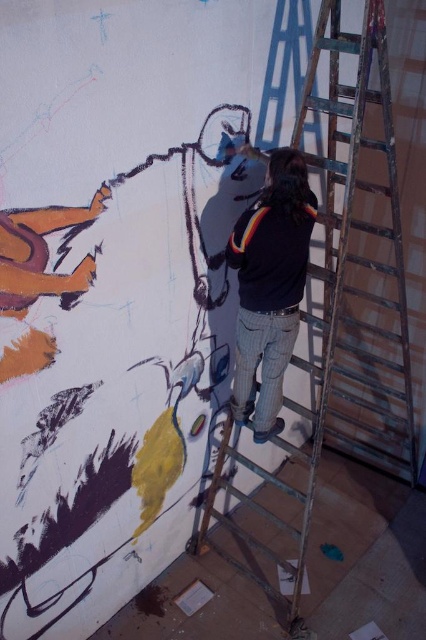
Who is taller, metallic silver ladder at center or black sweater at center?

metallic silver ladder at center is taller.

Does metallic silver ladder at center appear under black sweater at center?

Correct, metallic silver ladder at center is located below black sweater at center.

Between point (408, 476) and point (299, 288), which one is positioned in front?

Point (299, 288) is in front.

Where is `metallic silver ladder at center`? This screenshot has width=426, height=640. metallic silver ladder at center is located at coordinates (344, 294).